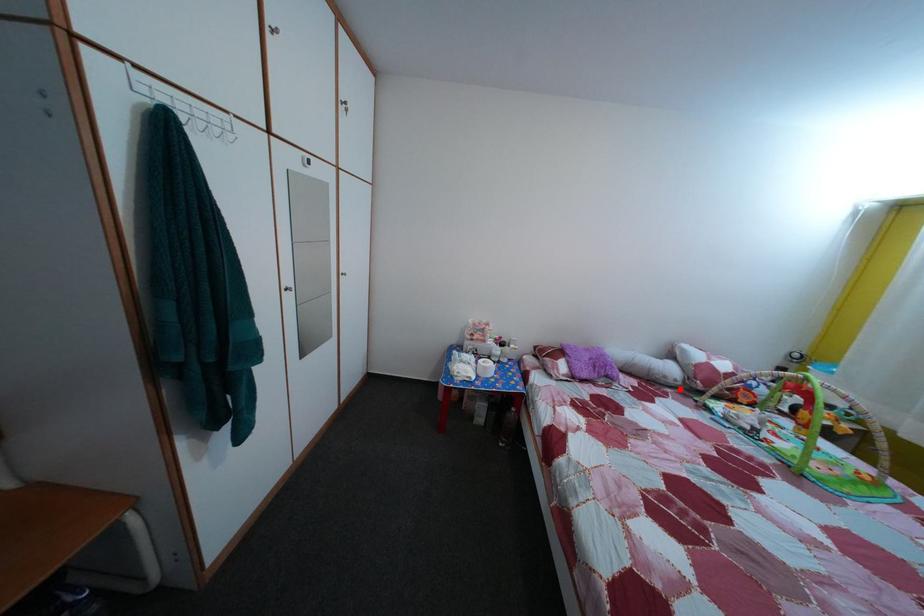
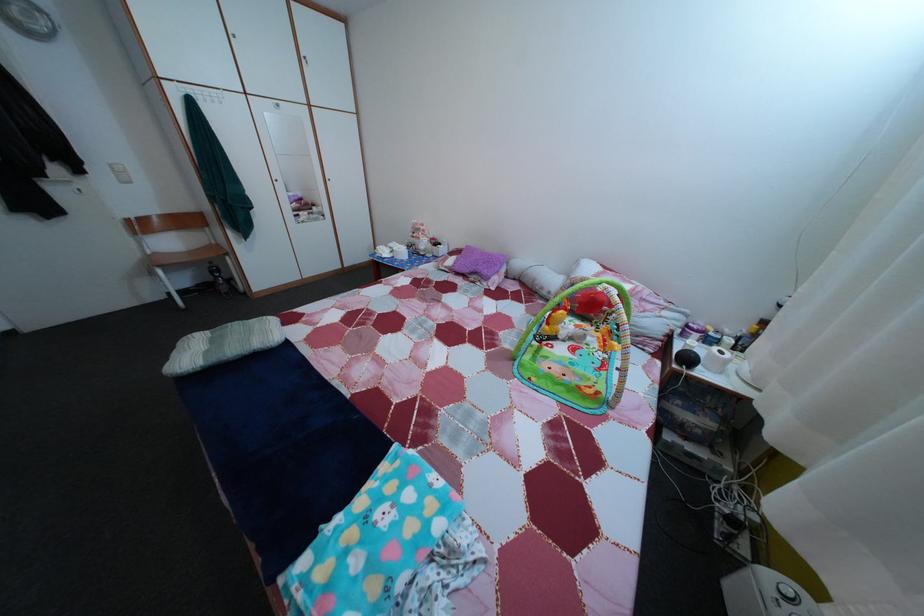
Find the pixel in the second image that matches the highlighted location in the first image.

(553, 301)